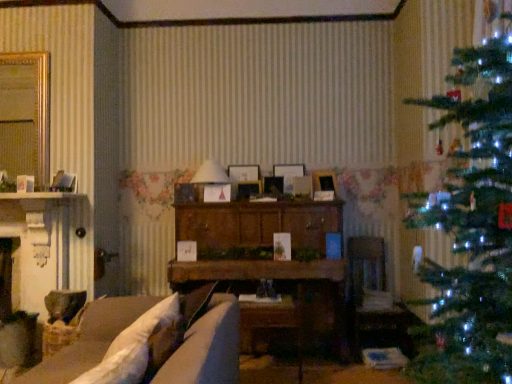
Question: From the image's perspective, does white paper lampshade at center appear lower than wooden cabinet at center?

Choices:
 (A) yes
 (B) no

Answer: (B)

Question: From a real-world perspective, is white paper lampshade at center under wooden cabinet at center?

Choices:
 (A) no
 (B) yes

Answer: (A)

Question: From a real-world perspective, is white paper lampshade at center physically above wooden cabinet at center?

Choices:
 (A) no
 (B) yes

Answer: (B)

Question: Is the position of white paper lampshade at center more distant than that of wooden cabinet at center?

Choices:
 (A) yes
 (B) no

Answer: (A)

Question: Is white paper lampshade at center to the right of wooden cabinet at center from the viewer's perspective?

Choices:
 (A) yes
 (B) no

Answer: (B)

Question: From the image's perspective, is wooden cabinet at center positioned above or below white paper lampshade at center?

Choices:
 (A) above
 (B) below

Answer: (B)

Question: In terms of width, does wooden cabinet at center look wider or thinner when compared to white paper lampshade at center?

Choices:
 (A) thin
 (B) wide

Answer: (B)

Question: From a real-world perspective, is wooden cabinet at center above or below white paper lampshade at center?

Choices:
 (A) above
 (B) below

Answer: (B)

Question: Considering the positions of wooden cabinet at center and white paper lampshade at center in the image, is wooden cabinet at center taller or shorter than white paper lampshade at center?

Choices:
 (A) tall
 (B) short

Answer: (A)

Question: Is wooden cabinet at center in front of or behind velvet brown armchair at center in the image?

Choices:
 (A) front
 (B) behind

Answer: (A)

Question: Is wooden cabinet at center taller or shorter than velvet brown armchair at center?

Choices:
 (A) short
 (B) tall

Answer: (B)

Question: From a real-world perspective, is wooden cabinet at center positioned above or below velvet brown armchair at center?

Choices:
 (A) above
 (B) below

Answer: (A)

Question: From the image's perspective, relative to velvet brown armchair at center, is wooden cabinet at center above or below?

Choices:
 (A) below
 (B) above

Answer: (B)

Question: Relative to wooden cabinet at center, is gold metallic mirror at upper left in front or behind?

Choices:
 (A) behind
 (B) front

Answer: (A)

Question: In the image, is gold metallic mirror at upper left on the left side or the right side of wooden cabinet at center?

Choices:
 (A) right
 (B) left

Answer: (B)